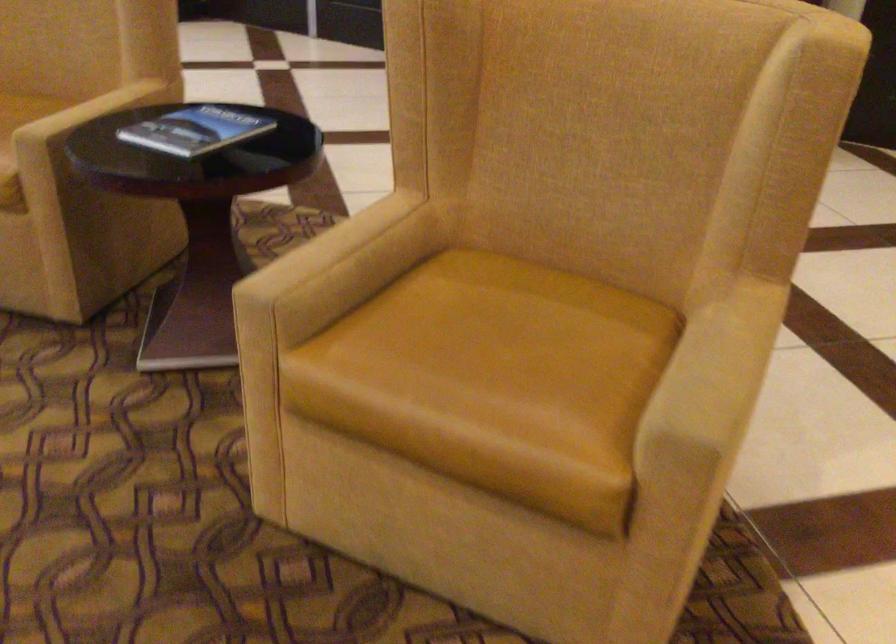
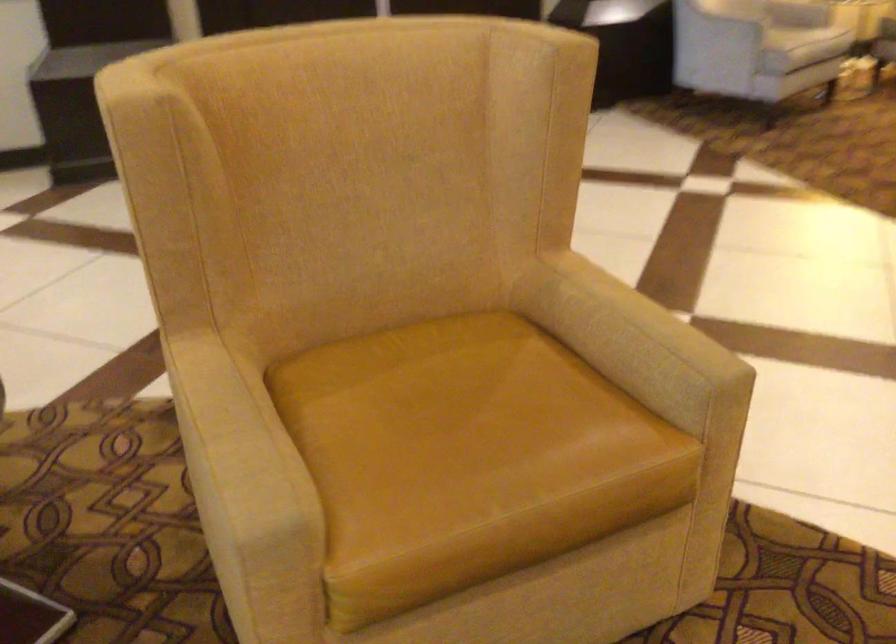
Where in the second image is the point corresponding to (x=489, y=341) from the first image?

(452, 426)